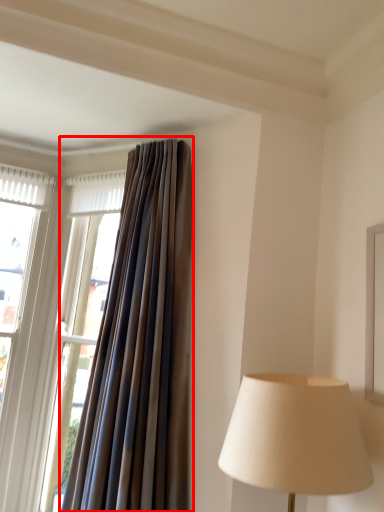
Question: From the image's perspective, considering the relative positions of curtain (annotated by the red box) and window in the image provided, where is curtain (annotated by the red box) located with respect to the staircase?

Choices:
 (A) below
 (B) above

Answer: (B)